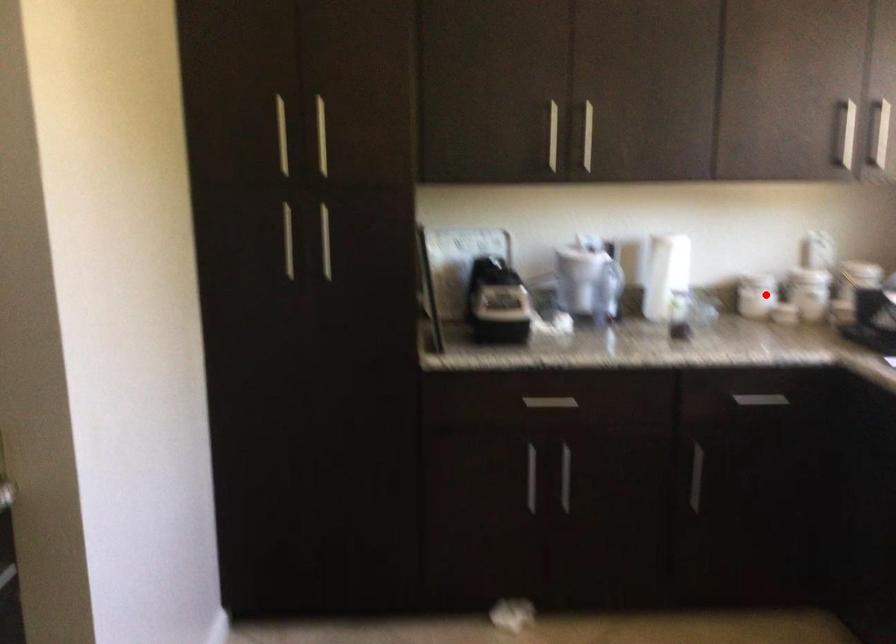
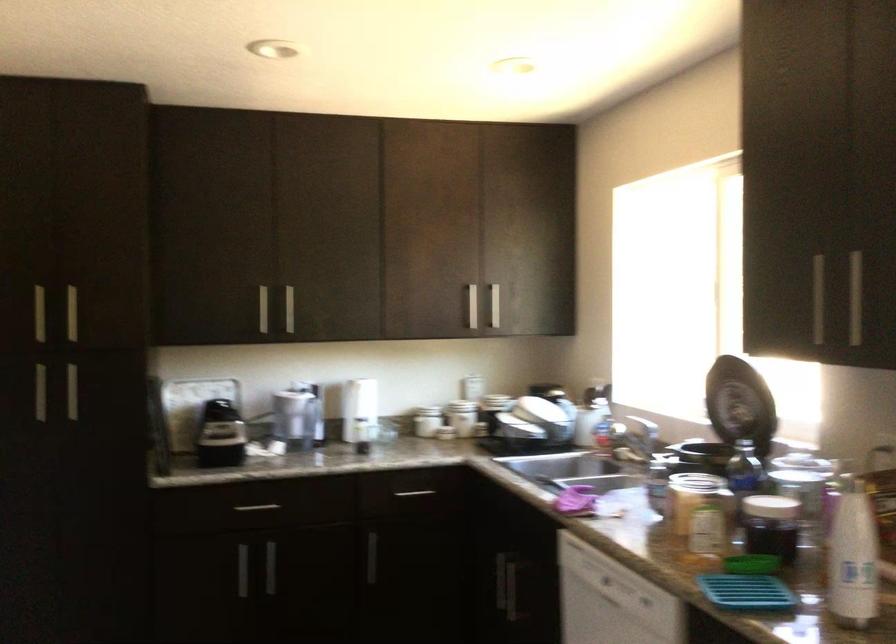
Question: A red point is marked in image1. In image2, is the corresponding 3D point closer to the camera or farther? Reply with the corresponding letter.

Choices:
 (A) The corresponding 3D point is closer.
 (B) The corresponding 3D point is farther.

Answer: (B)